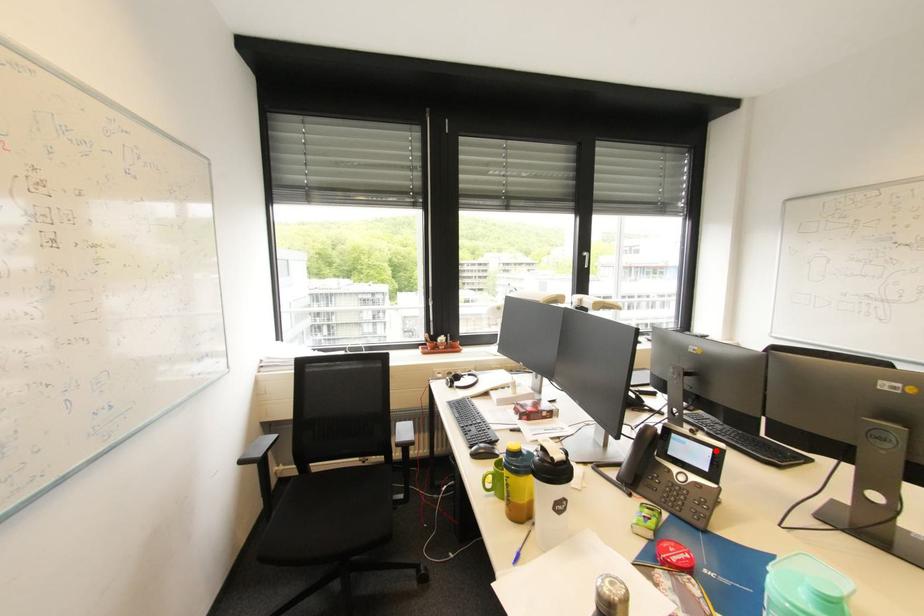
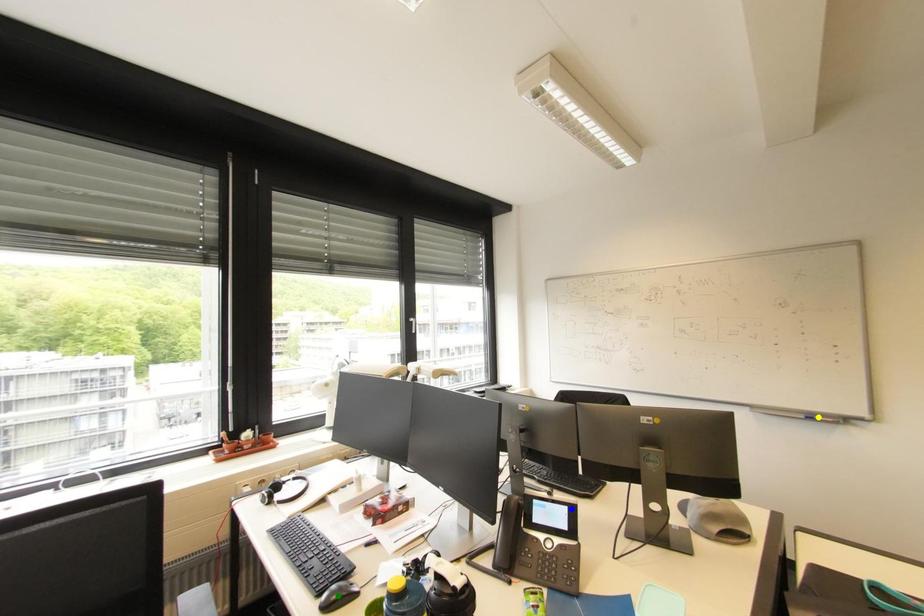
Question: I am providing you with two images of the same scene from different viewpoints. A red point is marked on the first image. You are given multiple points on the second image. Which point in image 2 represents the same 3d spot as the red point in image 1?

Choices:
 (A) green point
 (B) yellow point
 (C) blue point

Answer: (C)